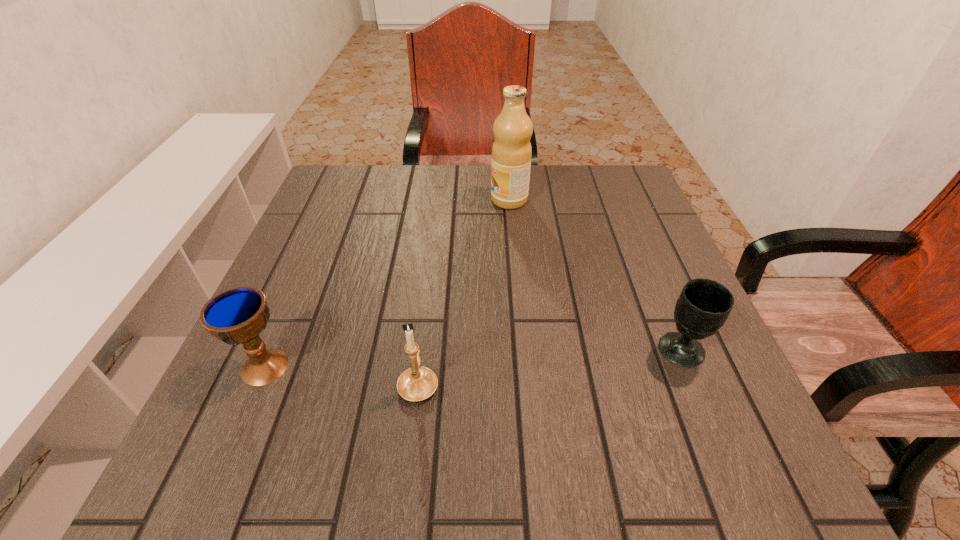
At what (x,y) coordinates should I click in order to perform the action: click on vacant area located 0.210m on the handle side of the candle holder. Please return your answer as a coordinate pair (x, y). This screenshot has height=540, width=960. Looking at the image, I should click on 431,279.

What are the coordinates of `free location located 0.230m on the back of the left chalice` in the screenshot? It's located at (310, 261).

At what (x,y) coordinates should I click in order to perform the action: click on free spot located on the left of the right chalice. Please return your answer as a coordinate pair (x, y). The image size is (960, 540). Looking at the image, I should click on (531, 350).

You are a GUI agent. You are given a task and a screenshot of the screen. Output one action in this format:
    pyautogui.click(x=<x>, y=<y>)
    Task: Click on the object located at the far edge
    The height and width of the screenshot is (540, 960).
    Given the screenshot: What is the action you would take?
    pyautogui.click(x=511, y=152)

Locate an element on the screen. This screenshot has width=960, height=540. object at the left edge is located at coordinates (237, 315).

This screenshot has width=960, height=540. Find the location of `object present at the right edge`. object present at the right edge is located at coordinates (704, 305).

Image resolution: width=960 pixels, height=540 pixels. Identify the location of free space at the far edge of the desktop. (548, 173).

The image size is (960, 540). What are the coordinates of `free space at the near edge of the desktop` in the screenshot? It's located at (396, 449).

In order to click on free region at the left edge of the desktop in this screenshot , I will do `click(345, 254)`.

At what (x,y) coordinates should I click in order to perform the action: click on vacant space at the right edge of the desktop. Please return your answer as a coordinate pair (x, y). This screenshot has width=960, height=540. Looking at the image, I should click on (674, 273).